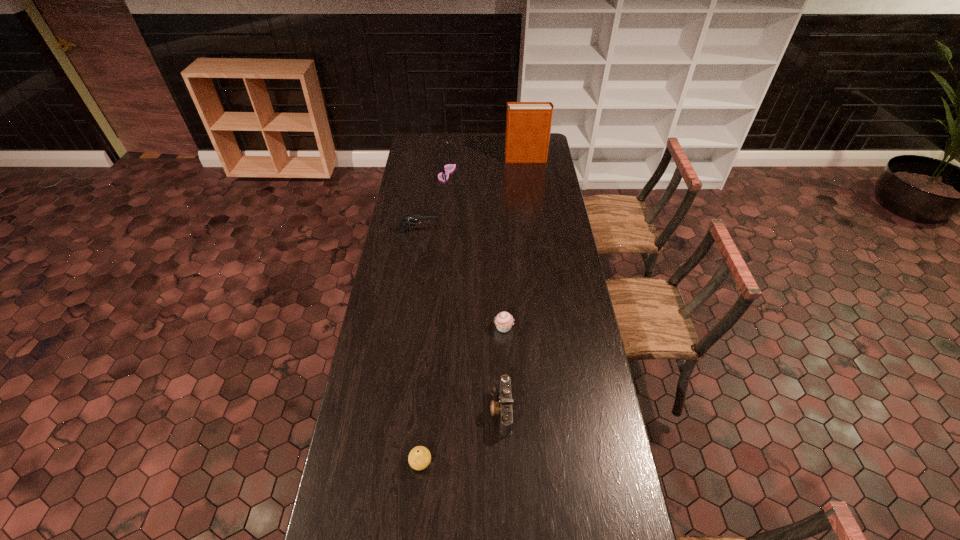
In order to click on vacant space located on the open cover of the rightmost object in this screenshot , I will do `click(447, 159)`.

Locate an element on the screen. This screenshot has height=540, width=960. free point located on the back of the second tallest object is located at coordinates (449, 149).

You are a GUI agent. You are given a task and a screenshot of the screen. Output one action in this format:
    pyautogui.click(x=<x>, y=<y>)
    Task: Click on the free space located 0.090m at the end of the barrel of the fourth nearest object
    
    Given the screenshot: What is the action you would take?
    pyautogui.click(x=459, y=231)

You are a GUI agent. You are given a task and a screenshot of the screen. Output one action in this format:
    pyautogui.click(x=<x>, y=<y>)
    Task: Click on the vacant space located on the front of the nearest object
    The height and width of the screenshot is (540, 960).
    Given the screenshot: What is the action you would take?
    pyautogui.click(x=418, y=495)

At what (x,y) coordinates should I click in order to perform the action: click on vacant region located on the front-facing side of the second nearest object. Please return your answer as a coordinate pair (x, y). Looking at the image, I should click on (436, 410).

The height and width of the screenshot is (540, 960). In order to click on free space located on the front-facing side of the second nearest object in this screenshot , I will do `click(457, 410)`.

The image size is (960, 540). Identify the location of free region located on the front-facing side of the second nearest object. (394, 410).

Image resolution: width=960 pixels, height=540 pixels. What are the coordinates of `blank area located on the right of the cupcake` in the screenshot? It's located at (577, 327).

Identify the location of object positioned at the left edge. (412, 219).

Where is `object present at the right edge`? The height and width of the screenshot is (540, 960). object present at the right edge is located at coordinates (528, 124).